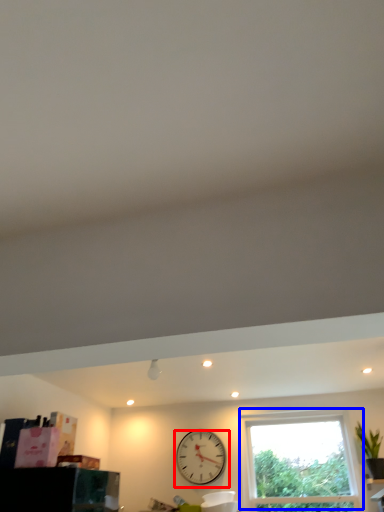
Question: Which of the following is the farthest to the observer, wall clock (highlighted by a red box) or window (highlighted by a blue box)?

Choices:
 (A) wall clock
 (B) window

Answer: (A)